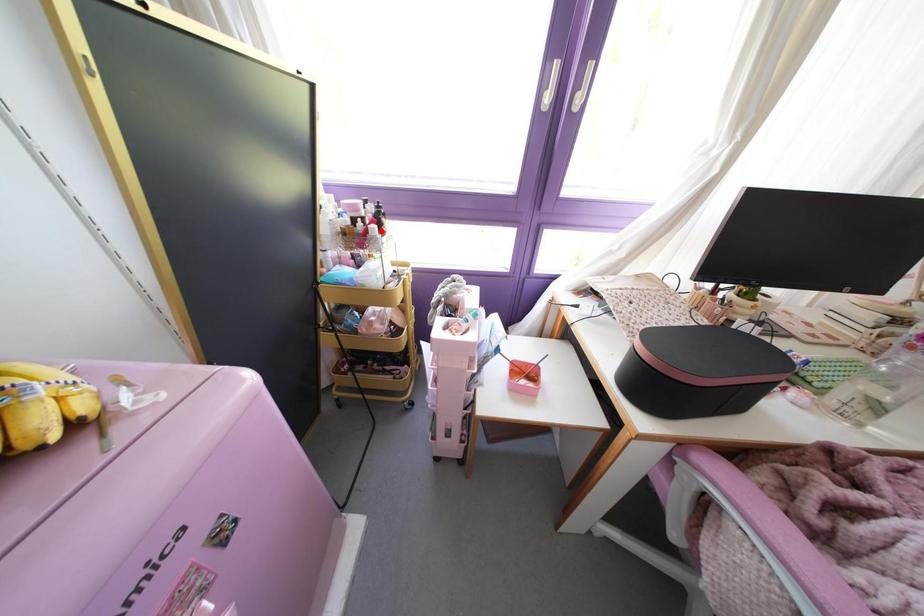
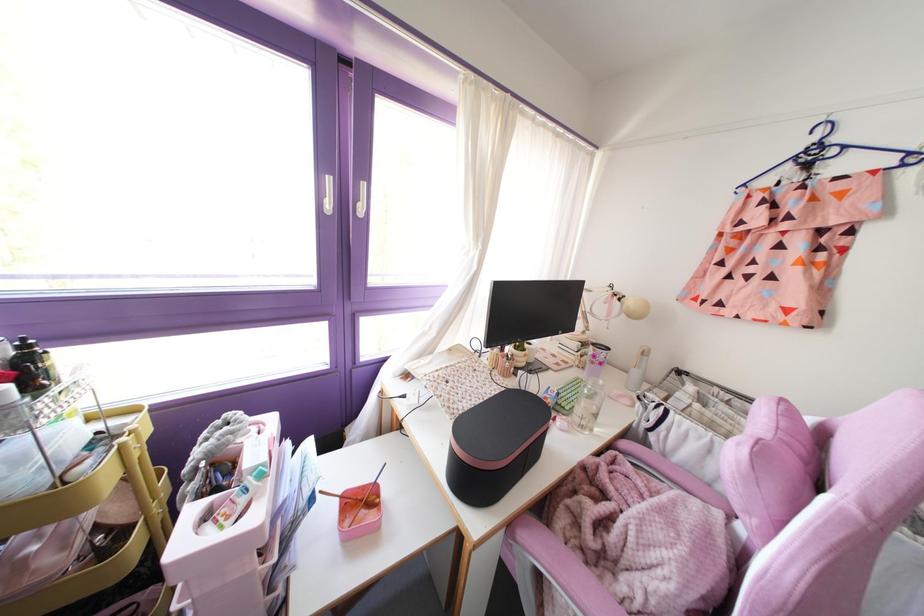
Find the pixel in the second image that matches the highlighted location in the first image.

(32, 389)